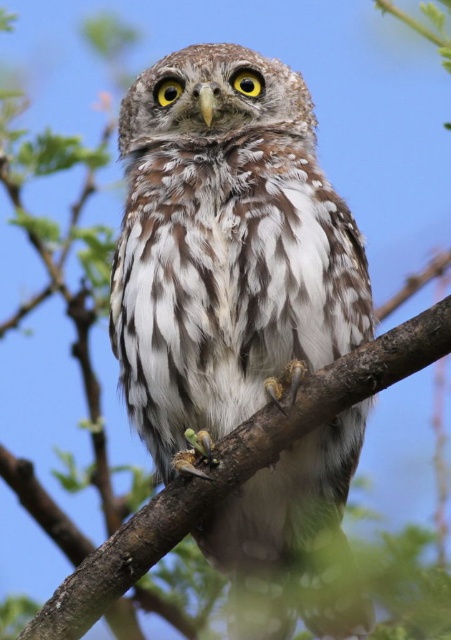
Question: Is brown feathered owl at center to the right of brown textured branch at center from the viewer's perspective?

Choices:
 (A) yes
 (B) no

Answer: (B)

Question: Considering the relative positions of brown feathered owl at center and brown textured branch at center in the image provided, where is brown feathered owl at center located with respect to brown textured branch at center?

Choices:
 (A) right
 (B) left

Answer: (B)

Question: Is brown feathered owl at center closer to camera compared to brown textured branch at center?

Choices:
 (A) yes
 (B) no

Answer: (B)

Question: Among these objects, which one is nearest to the camera?

Choices:
 (A) brown textured branch at center
 (B) brown feathered owl at center

Answer: (A)

Question: Which of the following is the farthest from the observer?

Choices:
 (A) (142, 595)
 (B) (142, 320)

Answer: (A)